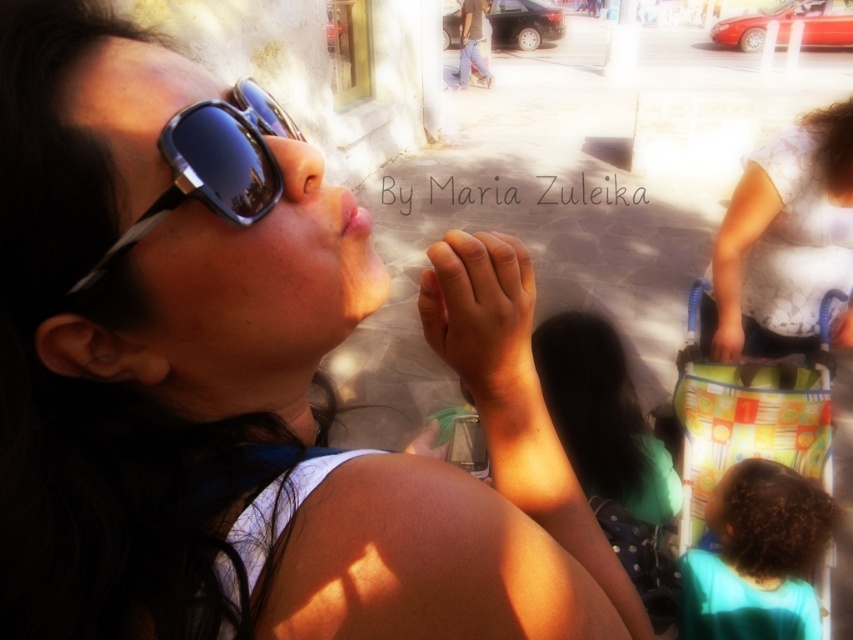
Question: Is multicolored fabric baby carriage at lower right wider than smooth plastic bag at lower right?

Choices:
 (A) no
 (B) yes

Answer: (B)

Question: Is white dotted shirt at upper right wider than smooth plastic bag at lower right?

Choices:
 (A) no
 (B) yes

Answer: (B)

Question: Which object is positioned closest to the multicolored fabric baby carriage at lower right?

Choices:
 (A) smooth skin hand at center
 (B) teal fabric shirt at lower right
 (C) smooth plastic bag at lower right

Answer: (C)

Question: Estimate the real-world distances between objects in this image. Which object is farther from the shiny black sunglasses at upper left?

Choices:
 (A) smooth plastic bag at lower right
 (B) white dotted shirt at upper right

Answer: (B)

Question: Considering the real-world distances, which object is closest to the shiny black sunglasses at upper left?

Choices:
 (A) multicolored fabric baby carriage at lower right
 (B) smooth skin hand at center
 (C) teal fabric shirt at lower right
 (D) white dotted shirt at upper right

Answer: (B)

Question: Is white dotted shirt at upper right below smooth plastic bag at lower right?

Choices:
 (A) yes
 (B) no

Answer: (B)